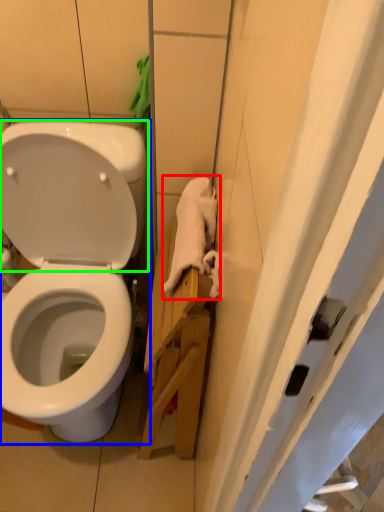
Question: Which object is the closest to the material (highlighted by a red box)? Choose among these: toilet (highlighted by a blue box) or back (highlighted by a green box).

Choices:
 (A) toilet
 (B) back

Answer: (B)